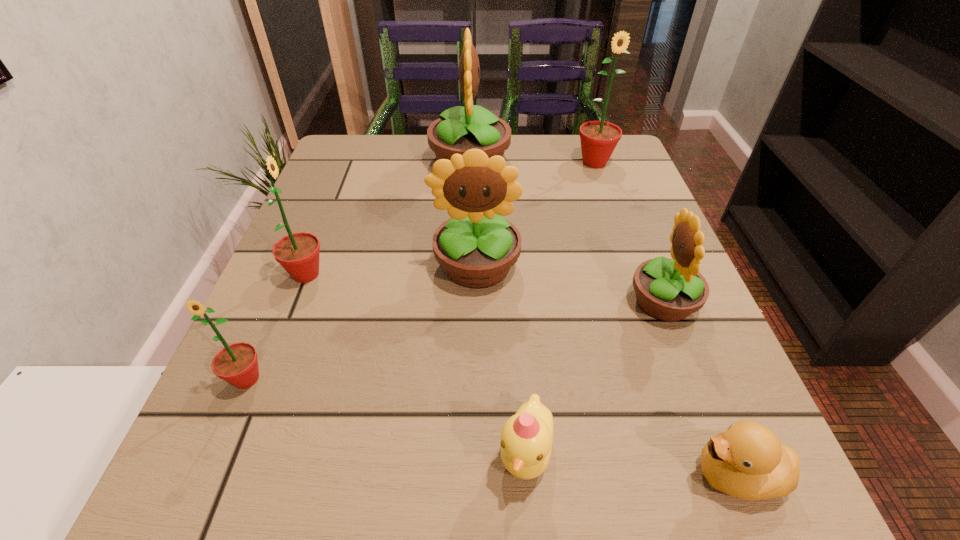
Identify the location of object that ranks as the sixth closest to the right duckling. The image size is (960, 540). (458, 129).

Locate an element on the screen. The image size is (960, 540). sunflower that stands as the third closest to the smallest green sunflower is located at coordinates (458, 129).

Identify which sunflower is the fifth nearest to the second biggest green sunflower. Please provide its 2D coordinates. Your answer should be formatted as a tuple, i.e. [(x, y)], where the tuple contains the x and y coordinates of a point satisfying the conditions above.

[(598, 139)]

Where is `the closest yellow sunflower to the biggest yellow sunflower`? Image resolution: width=960 pixels, height=540 pixels. the closest yellow sunflower to the biggest yellow sunflower is located at coordinates (476, 247).

At what (x,y) coordinates should I click in order to perform the action: click on yellow sunflower identified as the second closest to the right duckling. Please return your answer as a coordinate pair (x, y). Looking at the image, I should click on (476, 247).

Identify the location of the second closest green sunflower to the smallest green sunflower. (598, 139).

The image size is (960, 540). In order to click on green sunflower that stands as the second closest to the left duckling in this screenshot , I will do `click(298, 253)`.

You are a GUI agent. You are given a task and a screenshot of the screen. Output one action in this format:
    pyautogui.click(x=<x>, y=<y>)
    Task: Click on the vacant point that satisfies the following two spatial constraints: 1. on the face of the rightmost yellow sunflower; 2. on the face of the sixth farthest object
    The image size is (960, 540).
    Given the screenshot: What is the action you would take?
    pyautogui.click(x=693, y=379)

Identify the location of vacant point that satisfies the following two spatial constraints: 1. on the face of the smallest yellow sunflower; 2. on the front-facing side of the yellow duckling. (722, 453).

The width and height of the screenshot is (960, 540). In order to click on free region that satisfies the following two spatial constraints: 1. on the face of the rightmost yellow sunflower; 2. on the front-facing side of the left duckling in this screenshot , I will do `click(722, 453)`.